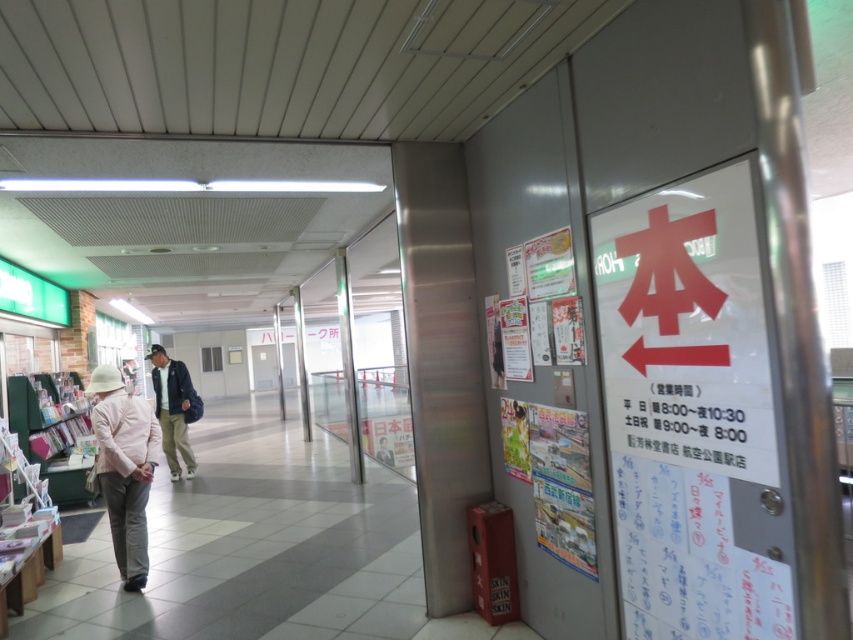
Question: Does light pink fabric hat at left appear over matte khaki pants at center?

Choices:
 (A) no
 (B) yes

Answer: (B)

Question: Can you confirm if light pink fabric hat at left is wider than matte khaki pants at center?

Choices:
 (A) yes
 (B) no

Answer: (B)

Question: Which point is closer to the camera?

Choices:
 (A) (173, 376)
 (B) (97, 422)

Answer: (B)

Question: Which object appears closest to the camera in this image?

Choices:
 (A) matte khaki pants at center
 (B) light pink fabric hat at left

Answer: (B)

Question: Can you confirm if light pink fabric hat at left is smaller than matte khaki pants at center?

Choices:
 (A) yes
 (B) no

Answer: (A)